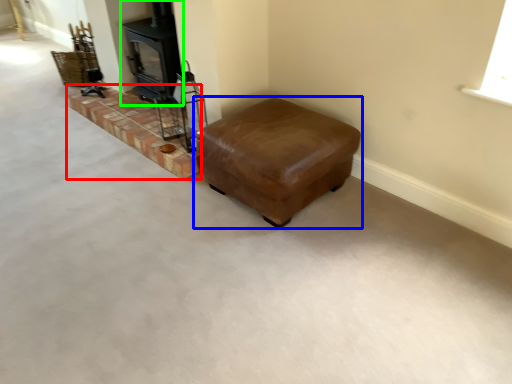
Question: Which object is the farthest from stairwell (highlighted by a red box)? Choose among these: furniture (highlighted by a blue box) or wood burning stove (highlighted by a green box).

Choices:
 (A) furniture
 (B) wood burning stove

Answer: (A)